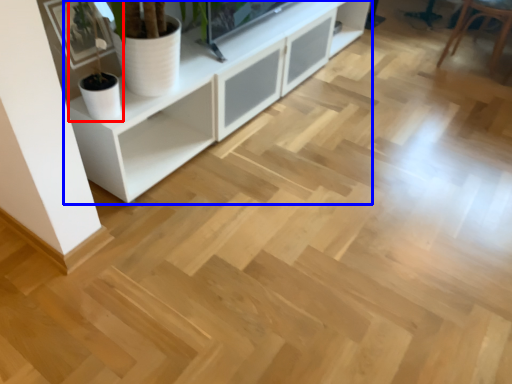
Question: Which object is further to the camera taking this photo, houseplant (highlighted by a red box) or cabinetry (highlighted by a blue box)?

Choices:
 (A) houseplant
 (B) cabinetry

Answer: (A)